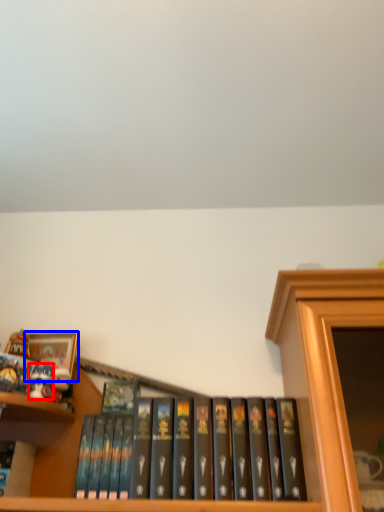
Question: Among these objects, which one is nearest to the camera, toy (highlighted by a red box) or picture frame (highlighted by a blue box)?

Choices:
 (A) toy
 (B) picture frame

Answer: (A)